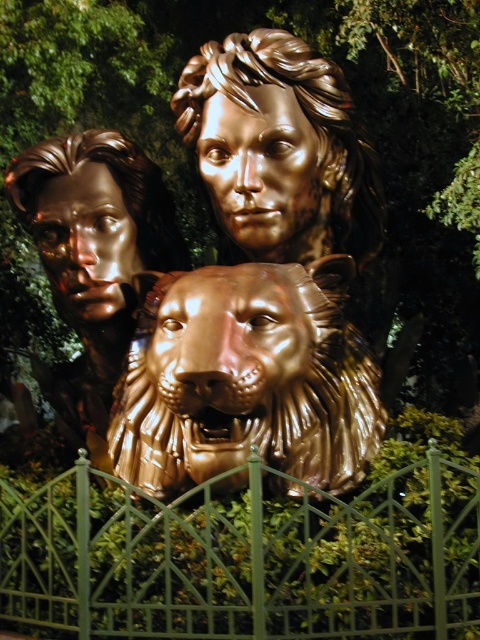
Who is more distant from viewer, (x=345, y=608) or (x=153, y=220)?

The point (x=153, y=220) is more distant.

Is point (373, 600) positioned behind point (15, 196)?

No, it is in front of (15, 196).

This screenshot has height=640, width=480. What are the coordinates of `green metal fence at center` in the screenshot? It's located at (245, 557).

Does shiny gold lion at center have a lesser width compared to gold polished head at center?

No, shiny gold lion at center is not thinner than gold polished head at center.

Is shiny gold lion at center taller than gold polished head at center?

No, shiny gold lion at center is not taller than gold polished head at center.

Where is `shiny gold lion at center`? shiny gold lion at center is located at coordinates (247, 380).

Can you confirm if green metal fence at center is taller than shiny gold lion at center?

Incorrect, green metal fence at center's height is not larger of shiny gold lion at center's.

Does green metal fence at center appear over shiny gold lion at center?

No, green metal fence at center is not above shiny gold lion at center.

Where is `green metal fence at center`? This screenshot has width=480, height=640. green metal fence at center is located at coordinates (245, 557).